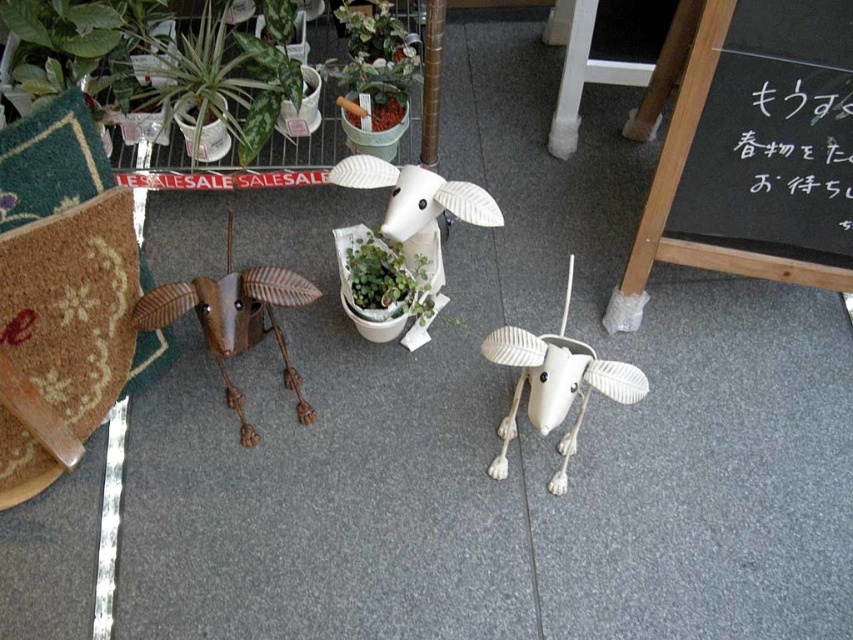
Question: Among these objects, which one is farthest from the camera?

Choices:
 (A) metallic brown goat at left
 (B) green glossy plant at upper center

Answer: (B)

Question: Which object is closer to the camera taking this photo?

Choices:
 (A) white matte sheep at center
 (B) green matte pot at center

Answer: (A)

Question: Can you confirm if green glossy plant at upper center is wider than white matte plastic goat at center?

Choices:
 (A) no
 (B) yes

Answer: (B)

Question: Which point is closer to the camera?

Choices:
 (A) (229, 209)
 (B) (799, 140)

Answer: (B)

Question: Does green glossy plant at upper center appear under metallic brown goat at left?

Choices:
 (A) yes
 (B) no

Answer: (B)

Question: Is black chalkboard at right to the left of white matte sheep at center from the viewer's perspective?

Choices:
 (A) yes
 (B) no

Answer: (B)